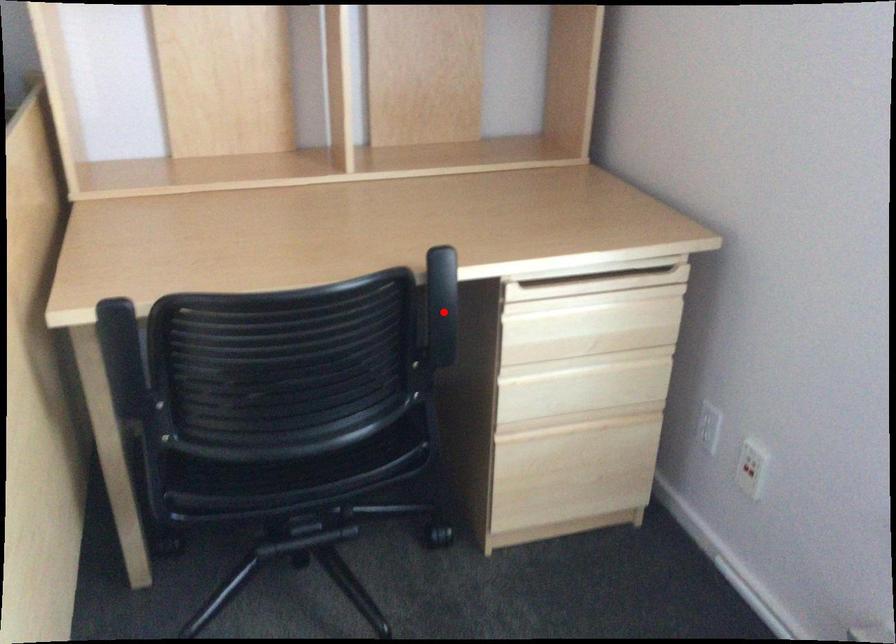
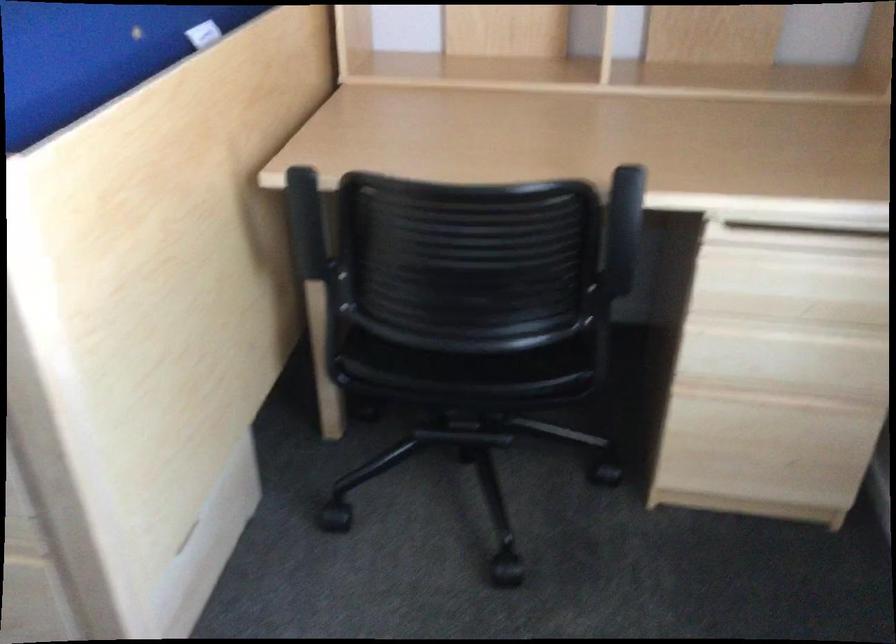
The point at the highlighted location is marked in the first image. Where is the corresponding point in the second image?

(625, 240)